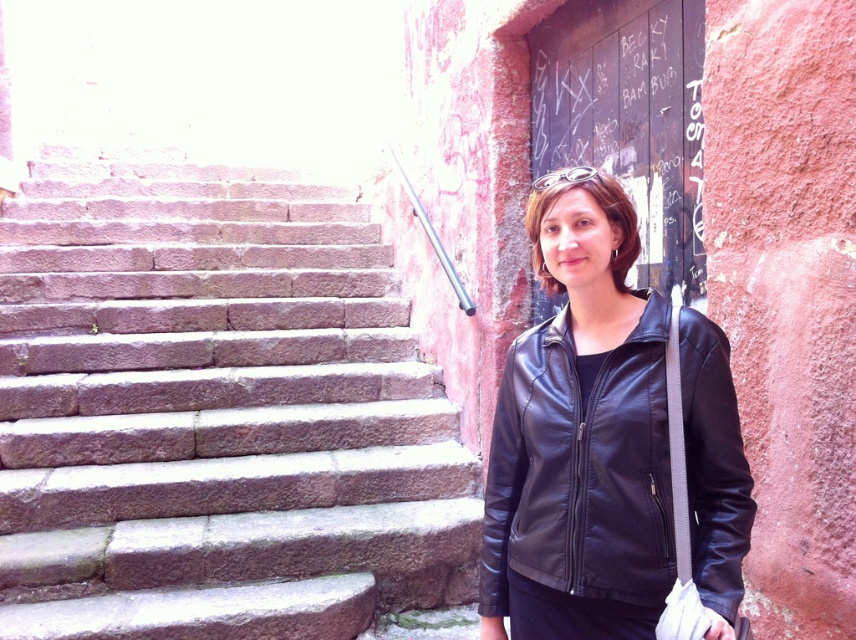
You are standing at the base of the stone stairs looking towards the door with graffiti. There are two points marked on the wall near the door. The first point is at coordinates point (x=379, y=422) and the second is at point (x=658, y=536). From your perspective, which point is closer to you?

Point (x=658, y=536) is closer to you because point (x=379, y=422) is behind it.

You are a delivery person with a 1.5 meter wide cart. You need to move from the brown stone stairs at left to the black leather jacket at right. Can your cart fit through the space between them?

The distance between the brown stone stairs at left and the black leather jacket at right is 1.72 meters. Since your cart is 1.5 meters wide, it can fit through the space between them as the distance is greater than the cart width.

You are a delivery person who needs to deliver a package to the door with graffiti. The stairs are at point (215,413). Where should you go to reach the door?

The brown stone stairs at left is located at point (215,413). To reach the door, you should go to the brown stone stairs at left and climb them to reach the door with graffiti.